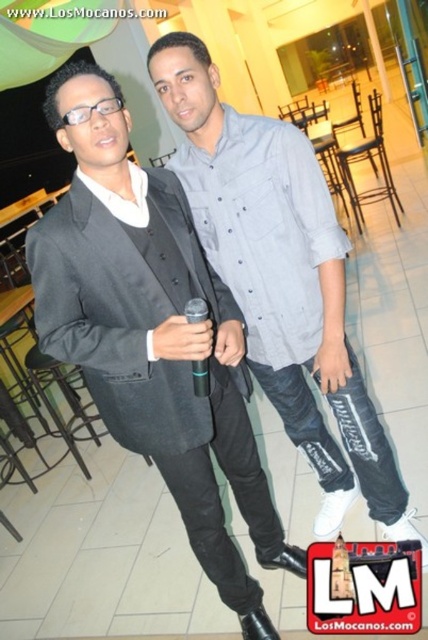
Question: Which point is farther from the camera taking this photo?

Choices:
 (A) (220, 458)
 (B) (214, 163)

Answer: (A)

Question: Observing the image, what is the correct spatial positioning of matte black suit at left in reference to gray cotton shirt at center?

Choices:
 (A) above
 (B) below

Answer: (B)

Question: Can you confirm if matte black suit at left is positioned below gray cotton shirt at center?

Choices:
 (A) no
 (B) yes

Answer: (B)

Question: Is matte black suit at left wider than gray cotton shirt at center?

Choices:
 (A) yes
 (B) no

Answer: (B)